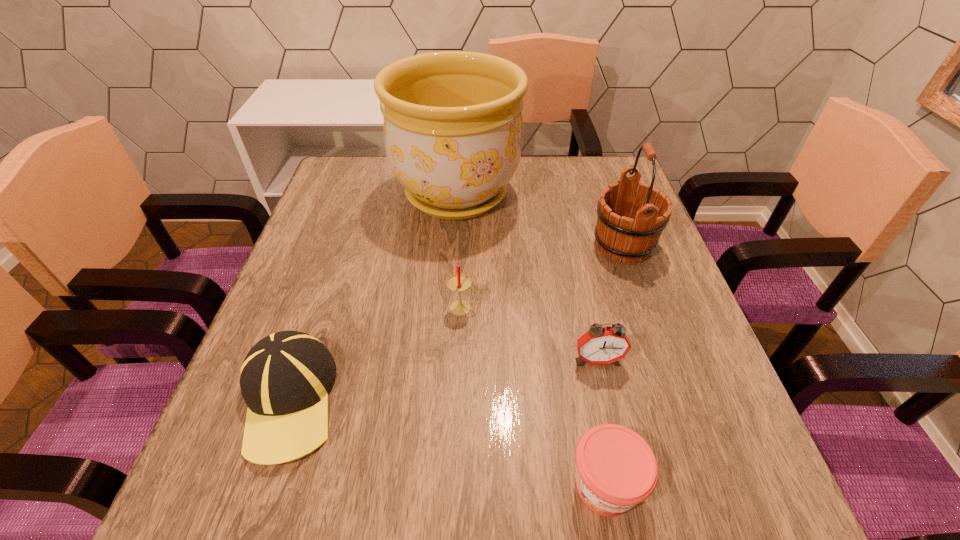
Where is `flowerpot`? The image size is (960, 540). flowerpot is located at coordinates (452, 120).

Image resolution: width=960 pixels, height=540 pixels. I want to click on the fifth shortest object, so click(631, 238).

I want to click on the fourth nearest object, so click(458, 282).

Locate an element on the screen. The image size is (960, 540). alarm clock is located at coordinates (600, 345).

The height and width of the screenshot is (540, 960). Identify the location of the leftmost object. click(285, 378).

This screenshot has width=960, height=540. I want to click on jam, so click(616, 469).

This screenshot has width=960, height=540. In order to click on free space located on the front of the tallest object in this screenshot , I will do `click(450, 293)`.

Where is `vacant space located 0.110m on the front of the wine bucket`? This screenshot has width=960, height=540. vacant space located 0.110m on the front of the wine bucket is located at coordinates (644, 307).

Identify the location of free spot located 0.250m on the left of the third farthest object. (330, 308).

Where is `vacant area located on the clock face of the alarm clock`? vacant area located on the clock face of the alarm clock is located at coordinates (626, 486).